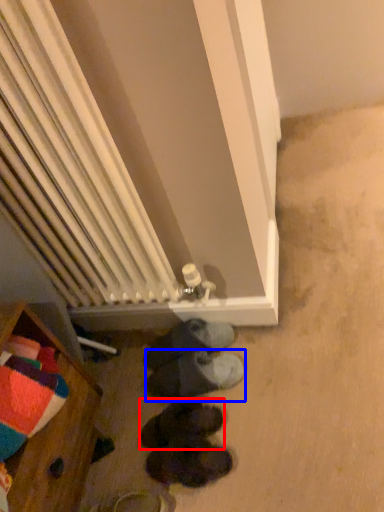
Question: Among these objects, which one is nearest to the camera, footwear (highlighted by a red box) or footwear (highlighted by a blue box)?

Choices:
 (A) footwear
 (B) footwear

Answer: (A)